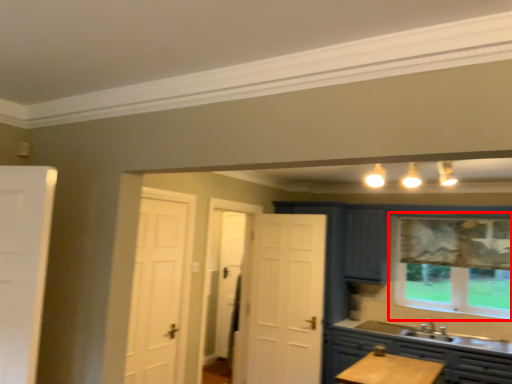
Question: From the image's perspective, what is the correct spatial relationship of window (annotated by the red box) in relation to cabinetry?

Choices:
 (A) below
 (B) above

Answer: (B)